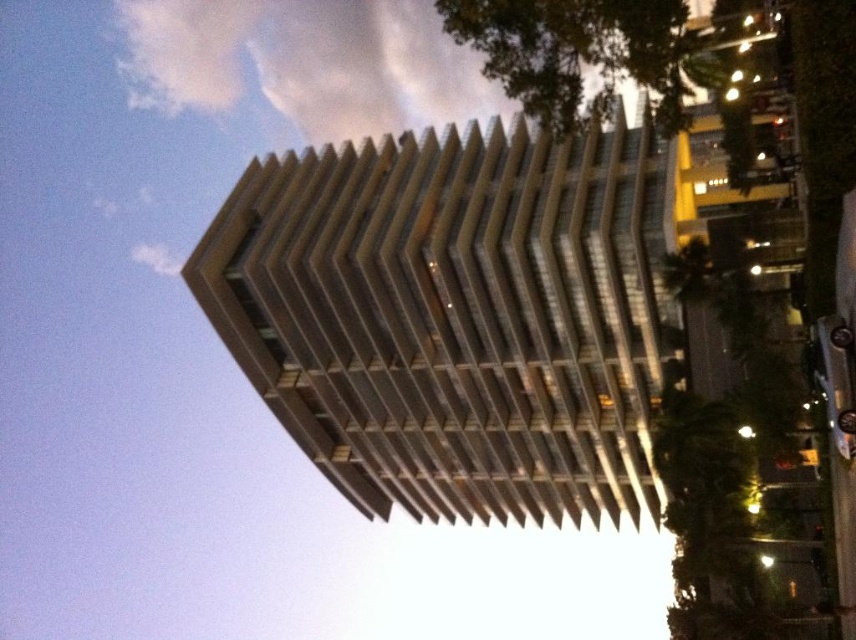
Who is positioned more to the left, sandy beige concrete building at center or white fluffy cloud at upper center?

white fluffy cloud at upper center is more to the left.

Which is behind, point (388, 400) or point (455, 28)?

Point (388, 400)

Is point (568, 465) in front of point (387, 74)?

That is True.

Locate an element on the screen. The height and width of the screenshot is (640, 856). sandy beige concrete building at center is located at coordinates (453, 316).